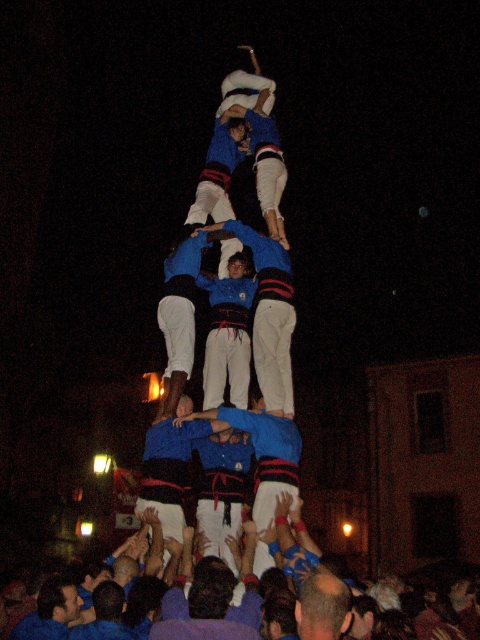
You are a photographer at the event and want to capture a photo of both the blue fabric pants at center and white cotton pants at center in the same frame. Based on their positions, which one should you focus on first to ensure both are in the shot?

The blue fabric pants at center is positioned on the right side of white cotton pants at center, so you should focus on the white cotton pants at center first to ensure both are in the shot.

You are a photographer at the event and want to capture a photo of the blue fabric pants at center and the bald head at center. Which object should you focus on if you want to ensure both are in sharp focus?

Since the blue fabric pants at center is bigger than the bald head at center, focusing on the blue fabric pants at center would ensure both are in sharp focus as it is larger and closer to the camera.

You are a photographer standing at the base of the castell human tower. You want to take a photo that includes both the blue fabric pants at center and the bald head at center. Given that your camera has a maximum focus range of 25 meters, will you be able to capture both subjects in focus?

The blue fabric pants at center and bald head at center are 25.24 meters apart, which exceeds the camera maximum focus range of 25 meters. Therefore, you cannot capture both subjects in focus.